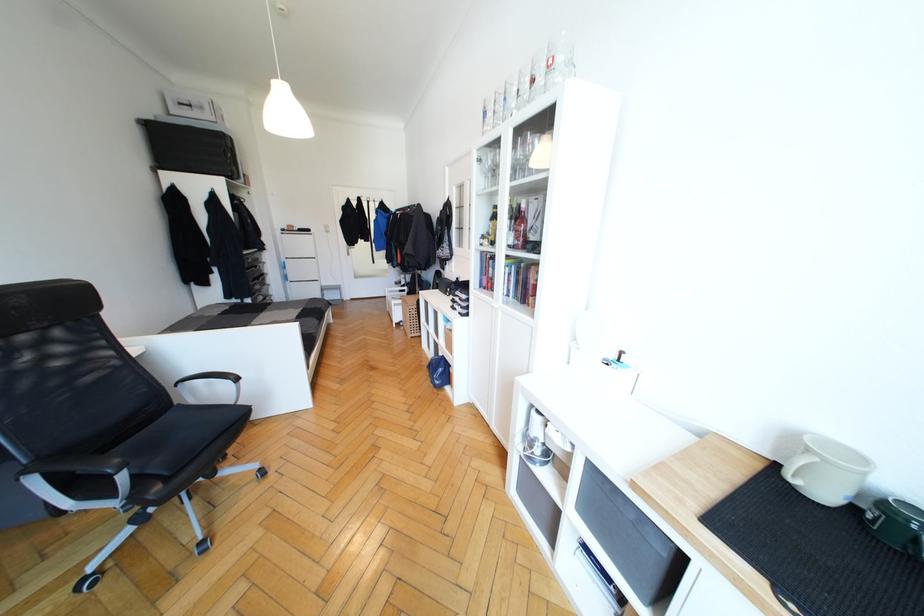
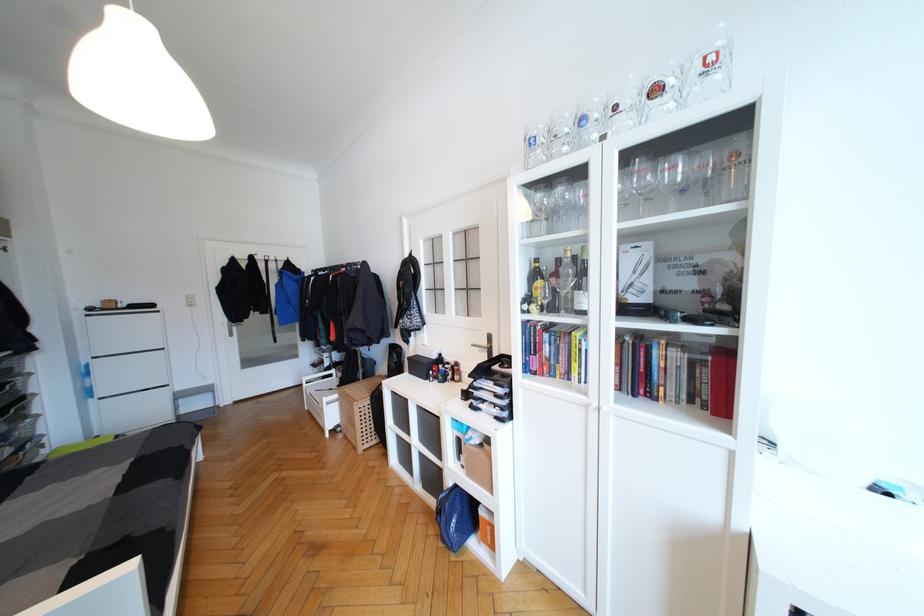
Find the pixel in the second image that matches (294,281) in the first image.

(103, 395)